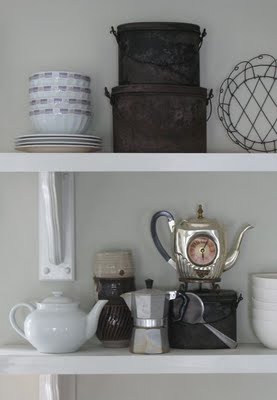
Identify the location of teapot handle. The width and height of the screenshot is (277, 400). (181, 311), (12, 315), (154, 234).